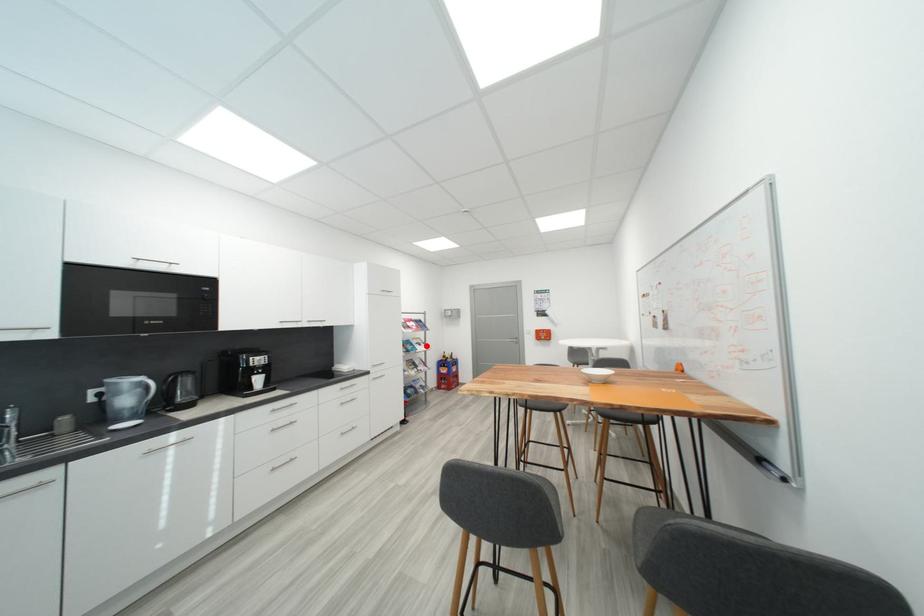
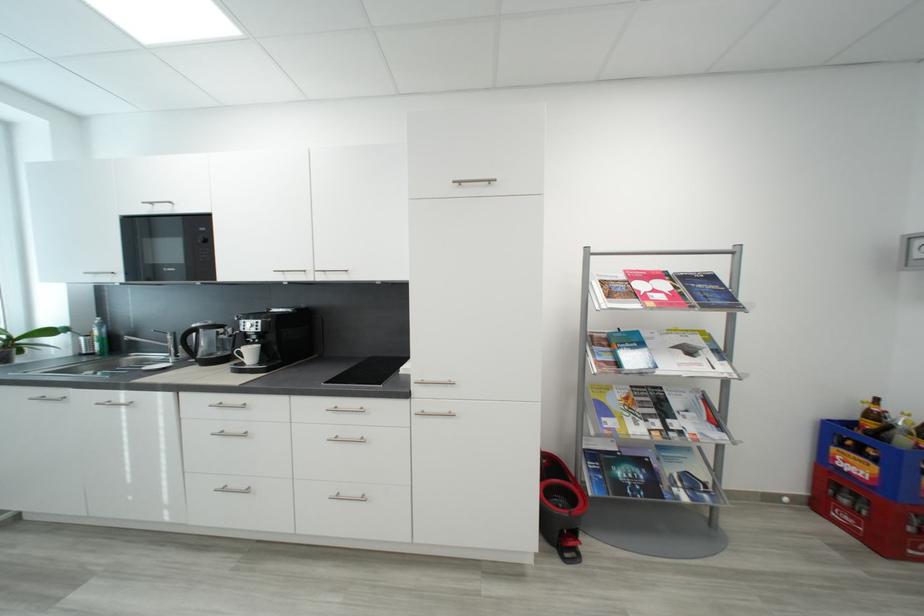
The point at the highlighted location is marked in the first image. Where is the corresponding point in the second image?

(697, 353)